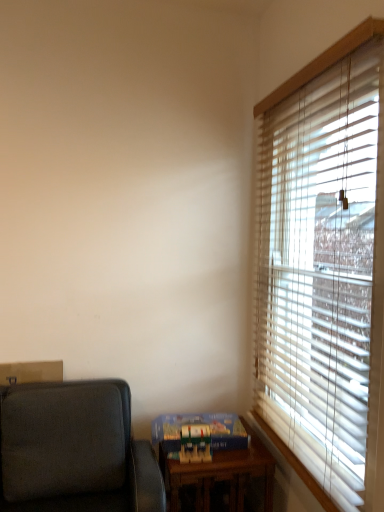
Question: Relative to dark gray fabric studio couch at lower left, is blue cardboard game set at lower center, marked as the first paperback book in a back-to-front arrangement, in front or behind?

Choices:
 (A) behind
 (B) front

Answer: (A)

Question: Is blue cardboard game set at lower center, marked as the first paperback book in a back-to-front arrangement, bigger or smaller than dark gray fabric studio couch at lower left?

Choices:
 (A) small
 (B) big

Answer: (A)

Question: Estimate the real-world distances between objects in this image. Which object is farther from the wooden blinds at right?

Choices:
 (A) dark gray fabric studio couch at lower left
 (B) wooden table at lower center
 (C) blue cardboard game set at lower center, marked as the first paperback book in a back-to-front arrangement
 (D) hardcover book at lower right, placed as the 2th paperback book when sorted from back to front

Answer: (A)

Question: Considering the real-world distances, which object is farthest from the wooden blinds at right?

Choices:
 (A) dark gray fabric studio couch at lower left
 (B) blue cardboard game set at lower center, marked as the first paperback book in a back-to-front arrangement
 (C) wooden table at lower center
 (D) hardcover book at lower right, placed as the 2th paperback book when sorted from back to front

Answer: (A)